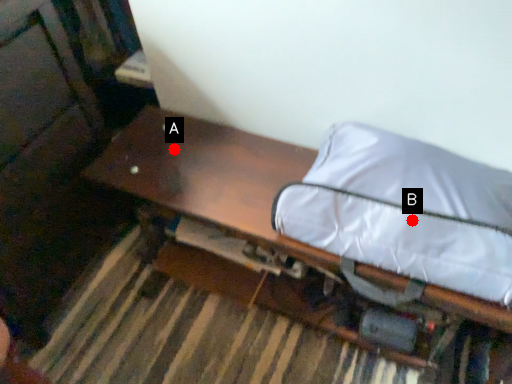
Question: Two points are circled on the image, labeled by A and B beside each circle. Which point is farther to the camera?

Choices:
 (A) A is further
 (B) B is further

Answer: (A)